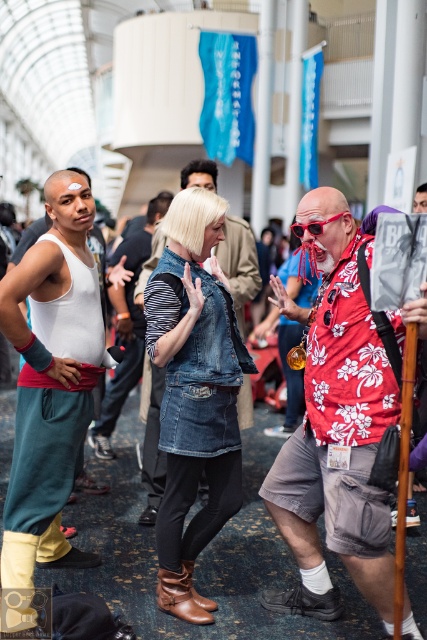
You are standing in the convention center and want to take a photo of both points. Which point, point (x=201, y=208) or point (x=107, y=451), is closer to you?

Point (x=201, y=208) is closer to the viewer than point (x=107, y=451).

You are standing in the convention center and want to take a photo of both the point at location (34, 340) and the point at (298, 236). Which point should you focus on first to ensure both are in clear view?

You should focus on the point at (34, 340) first because it is closer to you than the point at (298, 236), ensuring both are in clear view.

You are organizing a photo shoot and need to ensure that the floral print shirt at center and the white matte tank top at left are visible in the frame. Given their sizes, which clothing item might require more space to accommodate its width?

The floral print shirt at center has a larger width than the white matte tank top at left, so it would require more space to accommodate its width.